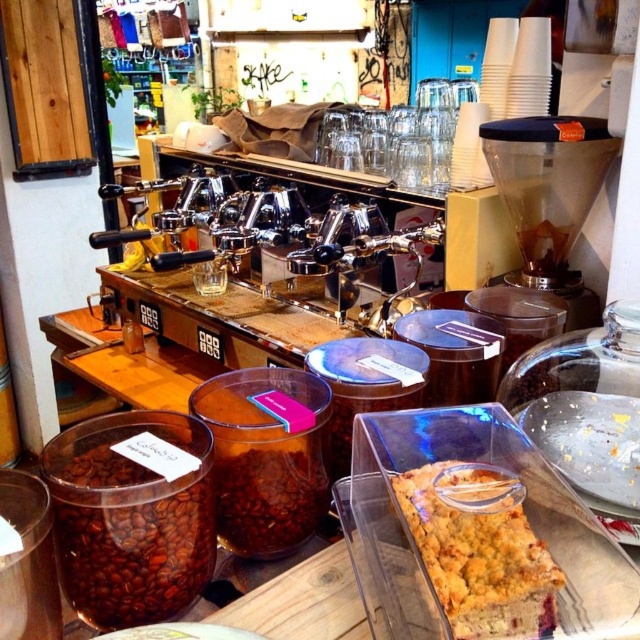
Is dark brown matte coffee beans at lower left above yellow crumbly cake at lower right?

Indeed, dark brown matte coffee beans at lower left is positioned over yellow crumbly cake at lower right.

From the picture: Is dark brown matte coffee beans at lower left further to the viewer compared to yellow crumbly cake at lower right?

Yes, dark brown matte coffee beans at lower left is behind yellow crumbly cake at lower right.

Locate an element on the screen. dark brown matte coffee beans at lower left is located at coordinates (131, 520).

Where is `dark brown matte coffee beans at lower left`? The height and width of the screenshot is (640, 640). dark brown matte coffee beans at lower left is located at coordinates (131, 520).